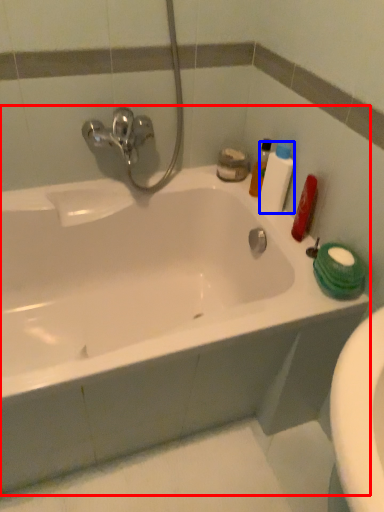
Question: Which object is further to the camera taking this photo, bathtub (highlighted by a red box) or toiletry (highlighted by a blue box)?

Choices:
 (A) bathtub
 (B) toiletry

Answer: (B)